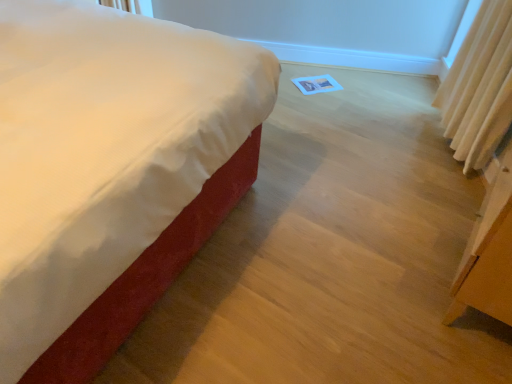
Where is `vacant space to the left of beige fabric curtain at right`? vacant space to the left of beige fabric curtain at right is located at coordinates (398, 156).